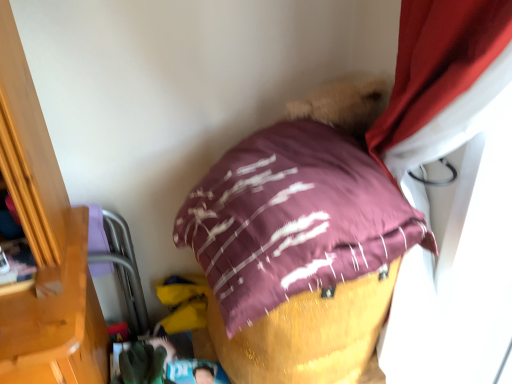
Question: Is purple fabric bean bag at left in front of maroon satin pillow at center?

Choices:
 (A) yes
 (B) no

Answer: (B)

Question: From a real-world perspective, is purple fabric bean bag at left positioned under maroon satin pillow at center based on gravity?

Choices:
 (A) yes
 (B) no

Answer: (A)

Question: From a real-world perspective, is purple fabric bean bag at left positioned over maroon satin pillow at center based on gravity?

Choices:
 (A) no
 (B) yes

Answer: (A)

Question: Is purple fabric bean bag at left taller than maroon satin pillow at center?

Choices:
 (A) yes
 (B) no

Answer: (A)

Question: Does purple fabric bean bag at left have a smaller size compared to maroon satin pillow at center?

Choices:
 (A) no
 (B) yes

Answer: (B)

Question: Considering the relative sizes of purple fabric bean bag at left and maroon satin pillow at center in the image provided, is purple fabric bean bag at left bigger than maroon satin pillow at center?

Choices:
 (A) no
 (B) yes

Answer: (A)

Question: From a real-world perspective, is green fabric glove at lower center under maroon satin pillow at center?

Choices:
 (A) yes
 (B) no

Answer: (A)

Question: Would you consider green fabric glove at lower center to be distant from maroon satin pillow at center?

Choices:
 (A) yes
 (B) no

Answer: (B)

Question: Is green fabric glove at lower center wider than maroon satin pillow at center?

Choices:
 (A) no
 (B) yes

Answer: (A)

Question: Is the depth of green fabric glove at lower center less than that of maroon satin pillow at center?

Choices:
 (A) no
 (B) yes

Answer: (A)

Question: Is the surface of green fabric glove at lower center in direct contact with maroon satin pillow at center?

Choices:
 (A) no
 (B) yes

Answer: (A)

Question: Is green fabric glove at lower center positioned with its back to maroon satin pillow at center?

Choices:
 (A) yes
 (B) no

Answer: (B)

Question: Could green fabric glove at lower center be considered to be inside purple fabric bean bag at left?

Choices:
 (A) yes
 (B) no

Answer: (B)